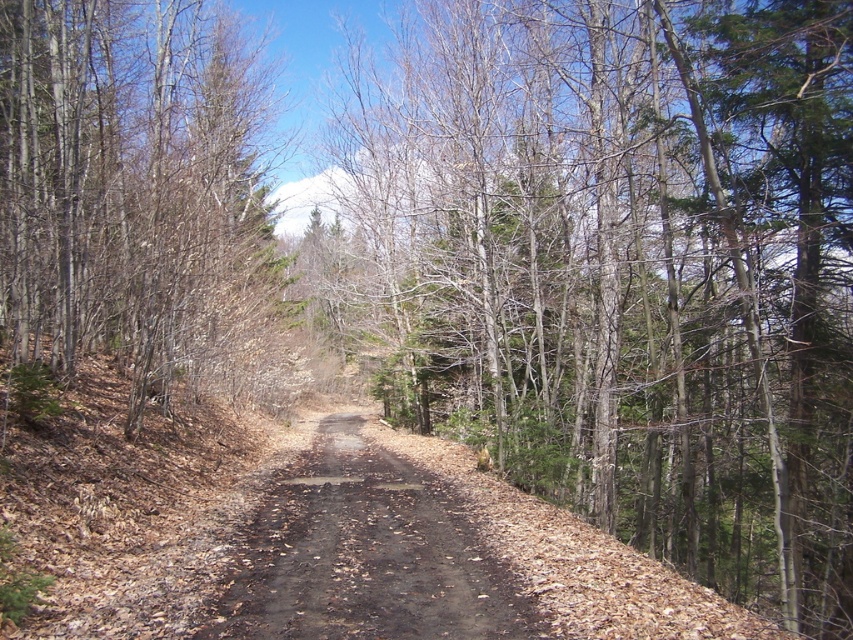
What do you see at coordinates (630, 268) in the screenshot? I see `brown/dry leaves at center` at bounding box center [630, 268].

In order to click on brown/dry leaves at center in this screenshot , I will do `click(630, 268)`.

Is the position of brown/dry leaves at center more distant than that of brown dirt track at center?

Yes, brown/dry leaves at center is further from the viewer.

Can you confirm if brown/dry leaves at center is positioned below brown dirt track at center?

No, brown/dry leaves at center is not below brown dirt track at center.

Between point (428, 193) and point (310, 552), which one is positioned in front?

Point (310, 552) is in front.

At what (x,y) coordinates should I click in order to perform the action: click on brown/dry leaves at center. Please return your answer as a coordinate pair (x, y). The image size is (853, 640). Looking at the image, I should click on (630, 268).

The width and height of the screenshot is (853, 640). Describe the element at coordinates (137, 195) in the screenshot. I see `brown bark tree at left` at that location.

The width and height of the screenshot is (853, 640). What do you see at coordinates (137, 195) in the screenshot?
I see `brown bark tree at left` at bounding box center [137, 195].

You are a GUI agent. You are given a task and a screenshot of the screen. Output one action in this format:
    pyautogui.click(x=<x>, y=<y>)
    Task: Click on the brown bark tree at left
    The height and width of the screenshot is (640, 853).
    Given the screenshot: What is the action you would take?
    pyautogui.click(x=137, y=195)